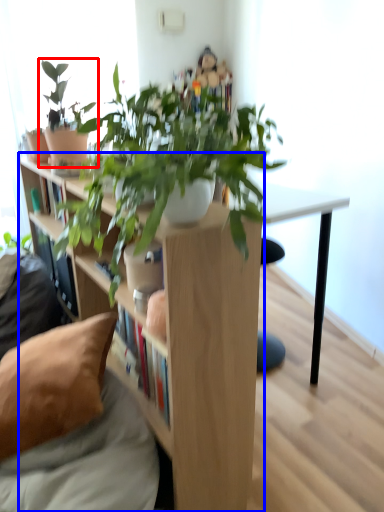
Question: Which of the following is the closest to the observer, houseplant (highlighted by a red box) or shelf (highlighted by a blue box)?

Choices:
 (A) houseplant
 (B) shelf

Answer: (B)